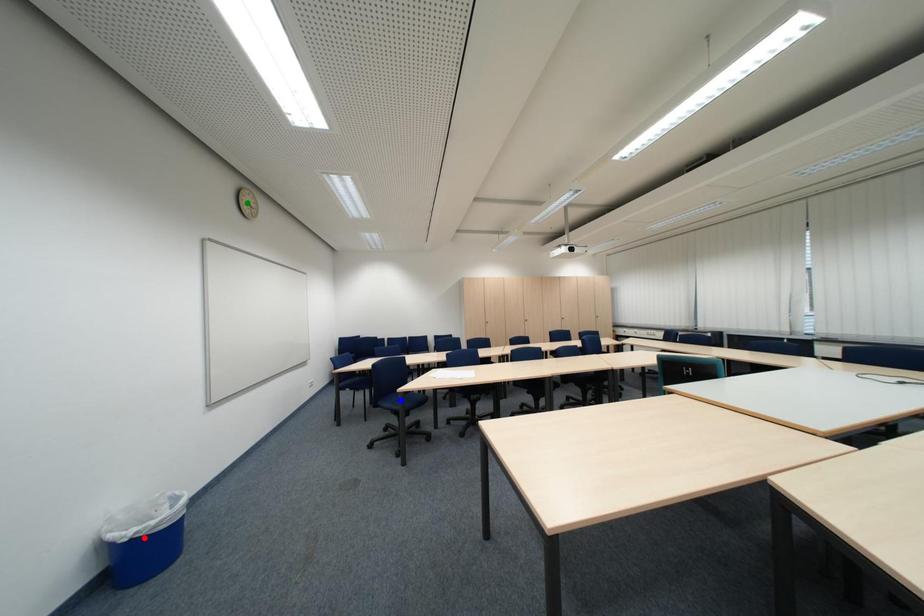
Order these from nearest to farthest:
blue point, red point, green point

red point < green point < blue point